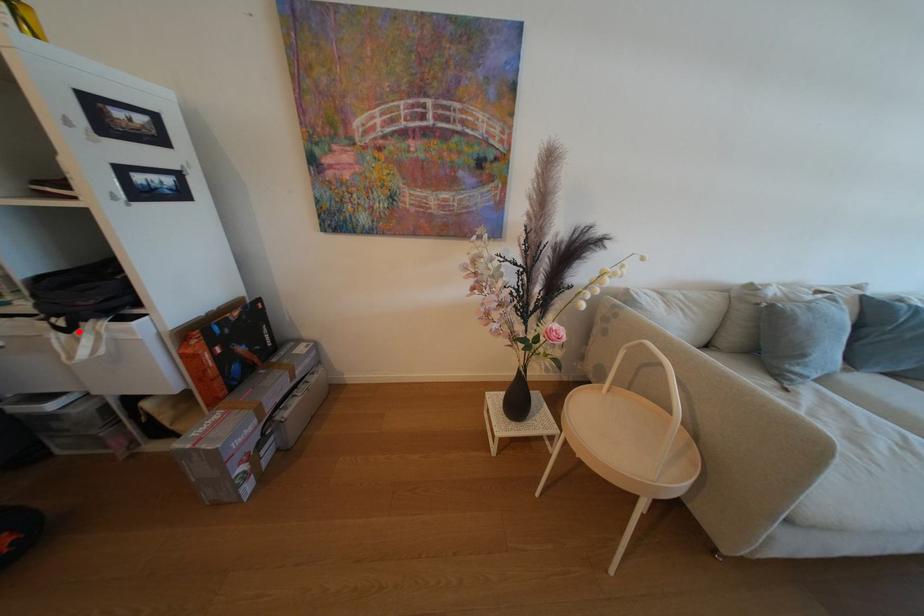
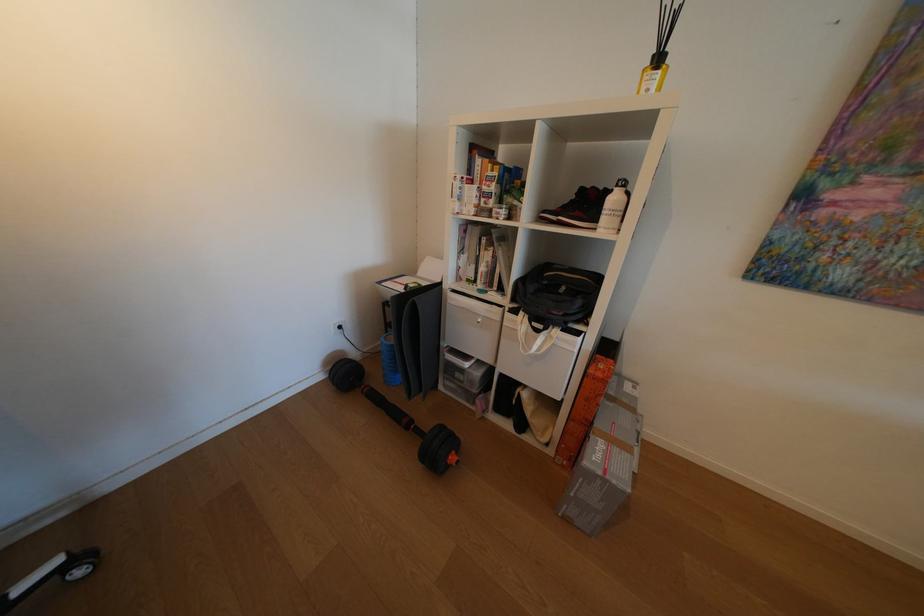
Where in the second image is the point corresponding to the highlighted location from the first image?

(548, 331)